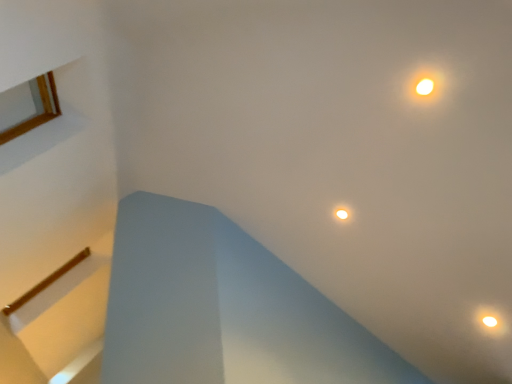
Question: Can you see matte yellow light at upper right touching matte gold droplight at center, which appears as the 2th droplight when viewed from the right?

Choices:
 (A) no
 (B) yes

Answer: (A)

Question: From a real-world perspective, is matte yellow light at upper right on top of matte gold droplight at center, which is counted as the 1th droplight, starting from the back?

Choices:
 (A) no
 (B) yes

Answer: (B)

Question: Is matte yellow light at upper right closer to the viewer compared to matte gold droplight at center, which is the 1th droplight from top to bottom?

Choices:
 (A) yes
 (B) no

Answer: (A)

Question: Is there a large distance between matte yellow light at upper right and matte gold droplight at center, which is counted as the second droplight, starting from the front?

Choices:
 (A) no
 (B) yes

Answer: (A)

Question: Does matte yellow light at upper right have a lesser width compared to matte gold droplight at center, which is counted as the 1th droplight, starting from the back?

Choices:
 (A) yes
 (B) no

Answer: (A)

Question: Does matte yellow light at upper right appear on the right side of matte gold droplight at center, which is the 1th droplight from top to bottom?

Choices:
 (A) yes
 (B) no

Answer: (A)

Question: From the image's perspective, is matte gold droplight at center, which ranks as the 1th droplight in left-to-right order, located beneath matte white droplight at lower right, placed as the 1th droplight when sorted from front to back?

Choices:
 (A) yes
 (B) no

Answer: (B)

Question: Considering the relative positions of matte gold droplight at center, which appears as the 2th droplight when viewed from the right, and matte white droplight at lower right, which is the first droplight from bottom to top, in the image provided, is matte gold droplight at center, which appears as the 2th droplight when viewed from the right, to the left of matte white droplight at lower right, which is the first droplight from bottom to top, from the viewer's perspective?

Choices:
 (A) yes
 (B) no

Answer: (A)

Question: Is matte gold droplight at center, which is counted as the second droplight, starting from the front, not inside matte white droplight at lower right, positioned as the second droplight in left-to-right order?

Choices:
 (A) yes
 (B) no

Answer: (A)

Question: Is the position of matte gold droplight at center, which is the 1th droplight from top to bottom, less distant than that of matte white droplight at lower right, placed as the 1th droplight when sorted from front to back?

Choices:
 (A) yes
 (B) no

Answer: (B)

Question: Considering the relative sizes of matte gold droplight at center, which is counted as the 1th droplight, starting from the back, and matte white droplight at lower right, positioned as the second droplight in left-to-right order, in the image provided, is matte gold droplight at center, which is counted as the 1th droplight, starting from the back, shorter than matte white droplight at lower right, positioned as the second droplight in left-to-right order,?

Choices:
 (A) no
 (B) yes

Answer: (A)

Question: Does matte gold droplight at center, which is counted as the 1th droplight, starting from the back, have a greater width compared to matte white droplight at lower right, which is the first droplight from bottom to top?

Choices:
 (A) no
 (B) yes

Answer: (A)

Question: Does matte yellow light at upper right come behind matte white droplight at lower right, which is the first droplight from bottom to top?

Choices:
 (A) yes
 (B) no

Answer: (B)